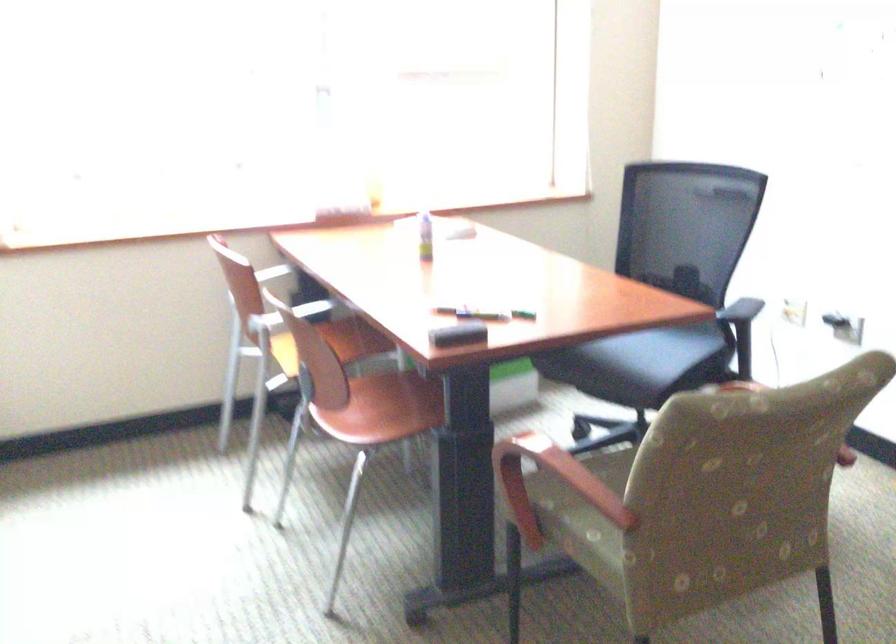
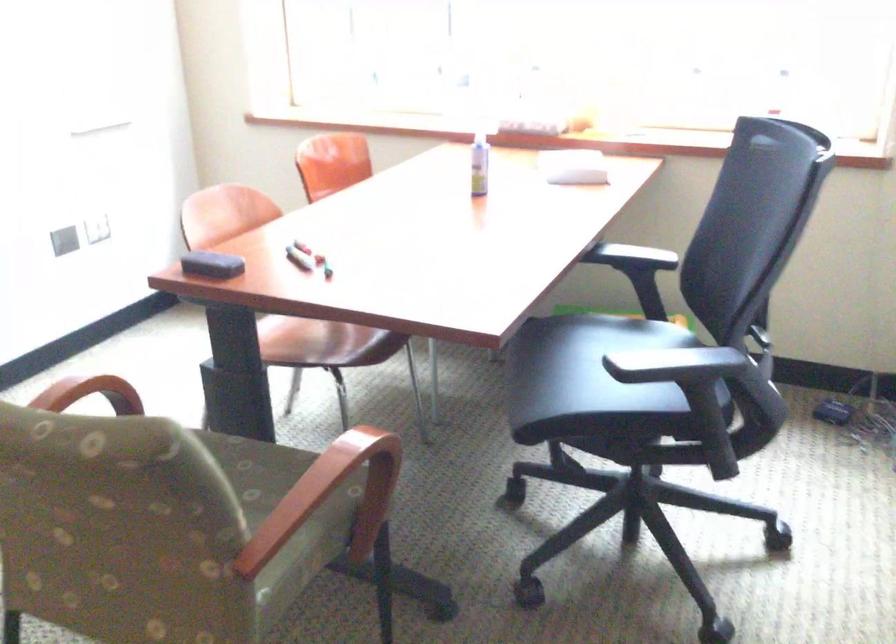
Where in the second image is the point corresponding to point 425,230 from the first image?

(478, 164)